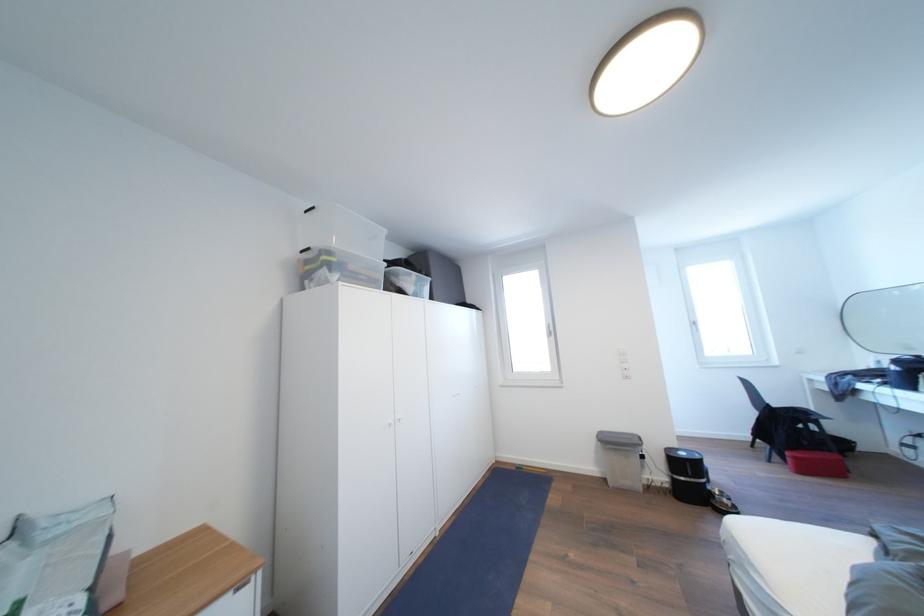
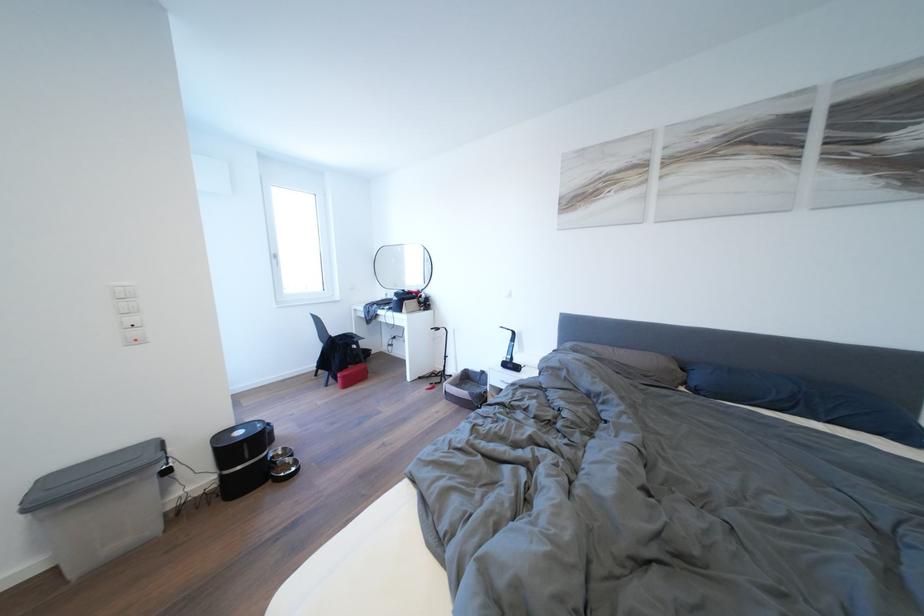
Where in the second image is the point corresponding to [734,506] from the first image?

(296, 466)